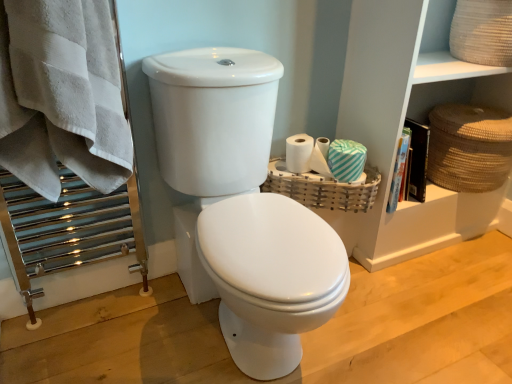
Image resolution: width=512 pixels, height=384 pixels. Identify the location of white matte toilet paper at center, which is the first toilet paper from left to right. (320, 157).

The image size is (512, 384). What do you see at coordinates (242, 206) in the screenshot?
I see `white glossy toilet at center` at bounding box center [242, 206].

This screenshot has width=512, height=384. What do you see at coordinates (323, 188) in the screenshot? I see `woven wood basket at right, the second basket in the right-to-left sequence` at bounding box center [323, 188].

What is the approximate height of woven wood basket at right, arranged as the 1th basket when viewed from the left?

It is 5.08 inches.

Describe the element at coordinates (469, 147) in the screenshot. I see `brown woven basket at right, the 1th basket viewed from the right` at that location.

The image size is (512, 384). What do you see at coordinates (307, 155) in the screenshot?
I see `teal striped toilet paper at right, the first toilet paper positioned from the right` at bounding box center [307, 155].

Image resolution: width=512 pixels, height=384 pixels. Find the location of `white matte toilet paper at center, the 2th toilet paper in the right-to-left sequence`. white matte toilet paper at center, the 2th toilet paper in the right-to-left sequence is located at coordinates (320, 157).

Are teal striped toilet paper at right, which is counted as the second toilet paper, starting from the left, and woven beige basket at upper right, which appears as the 2th shelf when ordered from the bottom, making contact?

No, teal striped toilet paper at right, which is counted as the second toilet paper, starting from the left, is not touching woven beige basket at upper right, which appears as the 2th shelf when ordered from the bottom.

Which object is more forward, teal striped toilet paper at right, the first toilet paper positioned from the right, or woven beige basket at upper right, which appears as the 2th shelf when ordered from the bottom?

woven beige basket at upper right, which appears as the 2th shelf when ordered from the bottom, is closer to the camera.

Can you confirm if teal striped toilet paper at right, the first toilet paper positioned from the right, is shorter than woven beige basket at upper right, the first shelf when ordered from top to bottom?

Yes, teal striped toilet paper at right, the first toilet paper positioned from the right, is shorter than woven beige basket at upper right, the first shelf when ordered from top to bottom.

Considering the positions of objects teal striped toilet paper at right, the first toilet paper positioned from the right, and woven beige basket at upper right, the first shelf when ordered from top to bottom, in the image provided, who is more to the left, teal striped toilet paper at right, the first toilet paper positioned from the right, or woven beige basket at upper right, the first shelf when ordered from top to bottom,?

teal striped toilet paper at right, the first toilet paper positioned from the right, is more to the left.

Would you say brown woven basket at right, the 1th basket viewed from the right, is to the left or to the right of woven wood basket at right, arranged as the 1th basket when viewed from the left, in the picture?

In the image, brown woven basket at right, the 1th basket viewed from the right, appears on the right side of woven wood basket at right, arranged as the 1th basket when viewed from the left.

Choose the correct answer: Is brown woven basket at right, the second basket when ordered from left to right, inside woven wood basket at right, arranged as the 1th basket when viewed from the left, or outside it?

brown woven basket at right, the second basket when ordered from left to right, is not inside woven wood basket at right, arranged as the 1th basket when viewed from the left, it's outside.

From a real-world perspective, who is located lower, brown woven basket at right, the second basket when ordered from left to right, or woven wood basket at right, arranged as the 1th basket when viewed from the left?

In real-world perspective, woven wood basket at right, arranged as the 1th basket when viewed from the left, is lower.

Is brown woven basket at right, the second basket when ordered from left to right, facing away from woven wood basket at right, the second basket in the right-to-left sequence?

That's not correct — brown woven basket at right, the second basket when ordered from left to right, is not looking away from woven wood basket at right, the second basket in the right-to-left sequence.

Considering the sizes of objects teal striped toilet paper at right, the first toilet paper positioned from the right, and white cotton towel at left in the image provided, who is smaller, teal striped toilet paper at right, the first toilet paper positioned from the right, or white cotton towel at left?

With smaller size is teal striped toilet paper at right, the first toilet paper positioned from the right.

From a real-world perspective, is teal striped toilet paper at right, the first toilet paper positioned from the right, above or below white cotton towel at left?

teal striped toilet paper at right, the first toilet paper positioned from the right, is below white cotton towel at left.

Could you measure the distance between teal striped toilet paper at right, the first toilet paper positioned from the right, and white cotton towel at left?

teal striped toilet paper at right, the first toilet paper positioned from the right, and white cotton towel at left are 28.64 inches apart from each other.

In the scene shown: Does teal striped toilet paper at right, which is counted as the second toilet paper, starting from the left, come in front of white cotton towel at left?

Result: No, the depth of teal striped toilet paper at right, which is counted as the second toilet paper, starting from the left, is greater than that of white cotton towel at left.

Does point (16, 67) come in front of point (458, 163)?

That is True.

From the image's perspective, is white cotton towel at left located above or below brown woven basket at right, the second basket when ordered from left to right?

Based on their image positions, white cotton towel at left is located above brown woven basket at right, the second basket when ordered from left to right.

Does white cotton towel at left have a larger size compared to brown woven basket at right, the second basket when ordered from left to right?

Incorrect, white cotton towel at left is not larger than brown woven basket at right, the second basket when ordered from left to right.

Considering the relative sizes of woven wood basket at right, arranged as the 1th basket when viewed from the left, and white matte toilet paper at center, the 2th toilet paper in the right-to-left sequence, in the image provided, is woven wood basket at right, arranged as the 1th basket when viewed from the left, smaller than white matte toilet paper at center, the 2th toilet paper in the right-to-left sequence,?

Actually, woven wood basket at right, arranged as the 1th basket when viewed from the left, might be larger than white matte toilet paper at center, the 2th toilet paper in the right-to-left sequence.

Which of these two, woven wood basket at right, arranged as the 1th basket when viewed from the left, or white matte toilet paper at center, which is the first toilet paper from left to right, is thinner?

white matte toilet paper at center, which is the first toilet paper from left to right, is thinner.

Do you think woven wood basket at right, arranged as the 1th basket when viewed from the left, is within white matte toilet paper at center, the 2th toilet paper in the right-to-left sequence, or outside of it?

woven wood basket at right, arranged as the 1th basket when viewed from the left, is not inside white matte toilet paper at center, the 2th toilet paper in the right-to-left sequence, it's outside.

Is woven wood basket at right, arranged as the 1th basket when viewed from the left, next to white matte toilet paper at center, which is the first toilet paper from left to right, and touching it?

Yes, woven wood basket at right, arranged as the 1th basket when viewed from the left, is beside white matte toilet paper at center, which is the first toilet paper from left to right.

Is rattan basket at upper right, which ranks as the first shelf in bottom-to-top order, in front of teal striped toilet paper at right, which is counted as the second toilet paper, starting from the left?

Yes, rattan basket at upper right, which ranks as the first shelf in bottom-to-top order, is closer to the camera.

Looking at the image, does rattan basket at upper right, which ranks as the first shelf in bottom-to-top order, seem bigger or smaller compared to teal striped toilet paper at right, the first toilet paper positioned from the right?

In the image, rattan basket at upper right, which ranks as the first shelf in bottom-to-top order, appears to be larger than teal striped toilet paper at right, the first toilet paper positioned from the right.

Identify the location of toilet paper that is the 1st object to the left of the rattan basket at upper right, which ranks as the first shelf in bottom-to-top order, starting at the anchor. (307, 155).

From a real-world perspective, is woven wood basket at right, the second basket in the right-to-left sequence, positioned under teal striped toilet paper at right, which is counted as the second toilet paper, starting from the left, based on gravity?

Yes, from a real-world perspective, woven wood basket at right, the second basket in the right-to-left sequence, is below teal striped toilet paper at right, which is counted as the second toilet paper, starting from the left.

Consider the image. In terms of width, does woven wood basket at right, the second basket in the right-to-left sequence, look wider or thinner when compared to teal striped toilet paper at right, which is counted as the second toilet paper, starting from the left?

woven wood basket at right, the second basket in the right-to-left sequence, is wider than teal striped toilet paper at right, which is counted as the second toilet paper, starting from the left.

Consider the image. How different are the orientations of woven wood basket at right, arranged as the 1th basket when viewed from the left, and teal striped toilet paper at right, the first toilet paper positioned from the right, in degrees?

The facing directions of woven wood basket at right, arranged as the 1th basket when viewed from the left, and teal striped toilet paper at right, the first toilet paper positioned from the right, are 35.2 degrees apart.

Locate an element on the screen. The height and width of the screenshot is (384, 512). the 1st toilet paper to the left of the woven beige basket at upper right, the first shelf when ordered from top to bottom, starting your count from the anchor is located at coordinates (307, 155).

Identify the location of basket below the brown woven basket at right, the second basket when ordered from left to right (from a real-world perspective). The width and height of the screenshot is (512, 384). (323, 188).

When comparing their distances from teal striped toilet paper at right, which is counted as the second toilet paper, starting from the left, does woven wood basket at right, the second basket in the right-to-left sequence, or rattan basket at upper right, acting as the second shelf starting from the top, seem closer?

woven wood basket at right, the second basket in the right-to-left sequence, is closer to teal striped toilet paper at right, which is counted as the second toilet paper, starting from the left.

When comparing their distances from white matte toilet paper at center, which is the first toilet paper from left to right, does woven beige basket at upper right, which appears as the 2th shelf when ordered from the bottom, or woven wood basket at right, arranged as the 1th basket when viewed from the left, seem closer?

woven wood basket at right, arranged as the 1th basket when viewed from the left, is closer to white matte toilet paper at center, which is the first toilet paper from left to right.

Which object lies further to the anchor point white glossy toilet at center, woven beige basket at upper right, which appears as the 2th shelf when ordered from the bottom, or woven wood basket at right, arranged as the 1th basket when viewed from the left?

woven beige basket at upper right, which appears as the 2th shelf when ordered from the bottom, is further to white glossy toilet at center.

When comparing their distances from woven beige basket at upper right, which appears as the 2th shelf when ordered from the bottom, does rattan basket at upper right, which ranks as the first shelf in bottom-to-top order, or teal striped toilet paper at right, the first toilet paper positioned from the right, seem closer?

rattan basket at upper right, which ranks as the first shelf in bottom-to-top order, is closer to woven beige basket at upper right, which appears as the 2th shelf when ordered from the bottom.

Estimate the real-world distances between objects in this image. Which object is further from brown woven basket at right, the 1th basket viewed from the right, white glossy toilet at center or white matte toilet paper at center, the 2th toilet paper in the right-to-left sequence?

Based on the image, white glossy toilet at center appears to be further to brown woven basket at right, the 1th basket viewed from the right.

Estimate the real-world distances between objects in this image. Which object is further from woven wood basket at right, the second basket in the right-to-left sequence, brown woven basket at right, the second basket when ordered from left to right, or white matte toilet paper at center, the 2th toilet paper in the right-to-left sequence?

brown woven basket at right, the second basket when ordered from left to right.

From the image, which object appears to be nearer to rattan basket at upper right, acting as the second shelf starting from the top, white cotton towel at left or brown woven basket at right, the second basket when ordered from left to right?

Among the two, brown woven basket at right, the second basket when ordered from left to right, is located nearer to rattan basket at upper right, acting as the second shelf starting from the top.

Based on their spatial positions, is woven beige basket at upper right, the first shelf when ordered from top to bottom, or brown woven basket at right, the 1th basket viewed from the right, further from white glossy toilet at center?

brown woven basket at right, the 1th basket viewed from the right.

Where is `basket between white cotton towel at left and woven beige basket at upper right, the first shelf when ordered from top to bottom, in the horizontal direction`? basket between white cotton towel at left and woven beige basket at upper right, the first shelf when ordered from top to bottom, in the horizontal direction is located at coordinates (323, 188).

Find the location of `toilet paper between white glossy toilet at center and white matte toilet paper at center, the 2th toilet paper in the right-to-left sequence, from front to back`. toilet paper between white glossy toilet at center and white matte toilet paper at center, the 2th toilet paper in the right-to-left sequence, from front to back is located at coordinates 307,155.

Where is `basket between white glossy toilet at center and woven beige basket at upper right, which appears as the 2th shelf when ordered from the bottom, from left to right`? This screenshot has height=384, width=512. basket between white glossy toilet at center and woven beige basket at upper right, which appears as the 2th shelf when ordered from the bottom, from left to right is located at coordinates (323, 188).

What are the coordinates of `basket between white matte toilet paper at center, the 2th toilet paper in the right-to-left sequence, and rattan basket at upper right, which ranks as the first shelf in bottom-to-top order, from left to right` in the screenshot? It's located at (323, 188).